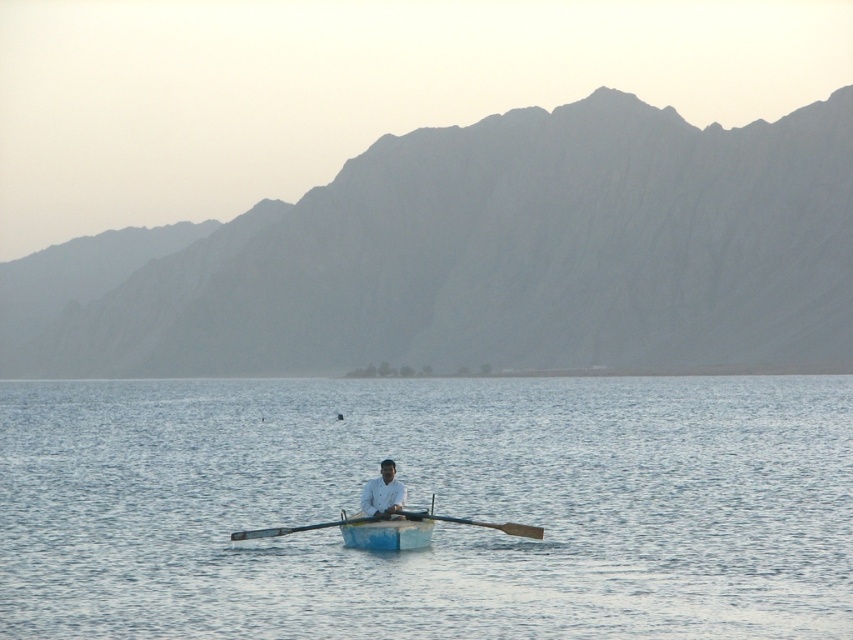
Question: Does gray rock mountain at upper center appear on the left side of wooden oar at center?

Choices:
 (A) no
 (B) yes

Answer: (B)

Question: Which object is farther from the camera taking this photo?

Choices:
 (A) blue painted wood canoe at center
 (B) wooden oar at center

Answer: (B)

Question: Is blue painted wood canoe at center positioned at the back of wooden oar at center?

Choices:
 (A) yes
 (B) no

Answer: (B)

Question: Which point is closer to the camera taking this photo?

Choices:
 (A) (538, 531)
 (B) (426, 385)
 (C) (366, 488)
 (D) (369, 529)

Answer: (D)

Question: Which is farther from the blue water at center?

Choices:
 (A) white matte shirt at center
 (B) blue painted wood canoe at center
 (C) wooden oar at center

Answer: (A)

Question: Does blue painted wood canoe at center have a larger size compared to wooden oar at center?

Choices:
 (A) yes
 (B) no

Answer: (B)